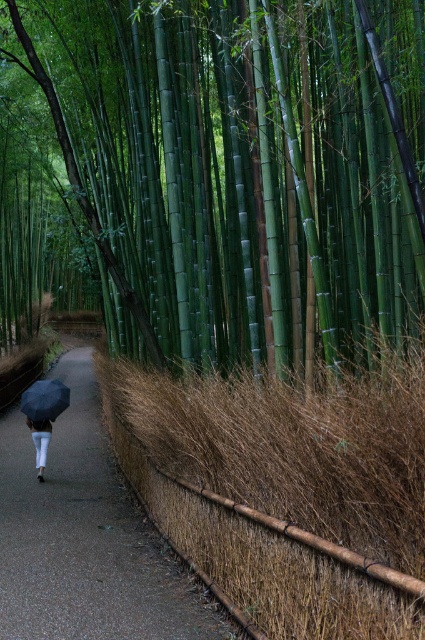
Between point (178, 572) and point (36, 420), which one is positioned in front?

Positioned in front is point (178, 572).

Can you confirm if brown woven mat at center is positioned to the right of matte black umbrella at lower left?

Yes, brown woven mat at center is to the right of matte black umbrella at lower left.

At what (x,y) coordinates should I click in order to perform the action: click on brown woven mat at center. Please return your answer as a coordinate pair (x, y). Looking at the image, I should click on (85, 538).

Where is `brown woven mat at center`? brown woven mat at center is located at coordinates (85, 538).

Where is `green bamboo forest at center`? green bamboo forest at center is located at coordinates (243, 170).

Who is positioned more to the right, green bamboo forest at center or white matte pants at lower left?

green bamboo forest at center is more to the right.

Where is `green bamboo forest at center`? green bamboo forest at center is located at coordinates (243, 170).

Can you confirm if matte black umbrella at lower left is taller than white matte pants at lower left?

Incorrect, matte black umbrella at lower left's height is not larger of white matte pants at lower left's.

How far apart are matte black umbrella at lower left and white matte pants at lower left?

A distance of 19.01 inches exists between matte black umbrella at lower left and white matte pants at lower left.

This screenshot has width=425, height=640. I want to click on matte black umbrella at lower left, so click(x=45, y=400).

Where is `matte black umbrella at lower left`? This screenshot has height=640, width=425. matte black umbrella at lower left is located at coordinates (45, 400).